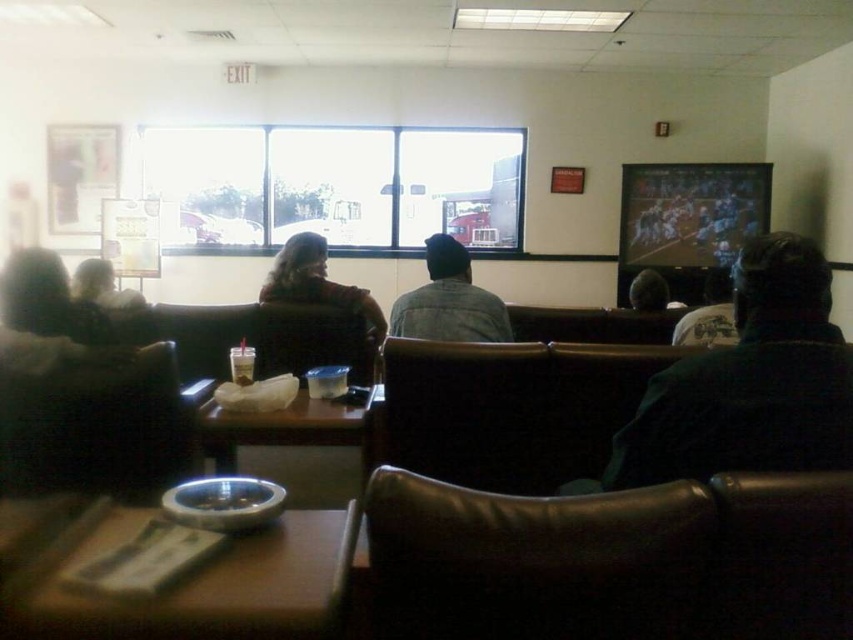
Is point (329, 442) behind point (618, 284)?

No, it is not.

Identify the location of wooden table at center. This screenshot has width=853, height=640. (281, 424).

Who is taller, dark green sweater at right or dark brown leather jacket at center?

dark brown leather jacket at center is taller.

Does dark green sweater at right lie behind dark brown leather jacket at center?

No, it is in front of dark brown leather jacket at center.

Is point (791, 342) farther from camera compared to point (368, 305)?

No, (791, 342) is closer to viewer.

Find the location of a particular element. Image resolution: width=853 pixels, height=640 pixels. dark green sweater at right is located at coordinates (750, 381).

Does dark green sweater at right have a greater width compared to dark gray knit cap at center?

Indeed, dark green sweater at right has a greater width compared to dark gray knit cap at center.

Identify the location of dark green sweater at right. (750, 381).